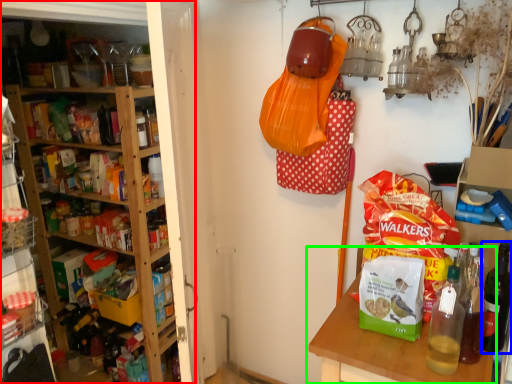
Question: Considering the real-world distances, which object is farthest from shelf (highlighted by a red box)? bottle (highlighted by a blue box) or table (highlighted by a green box)?

Choices:
 (A) bottle
 (B) table

Answer: (A)